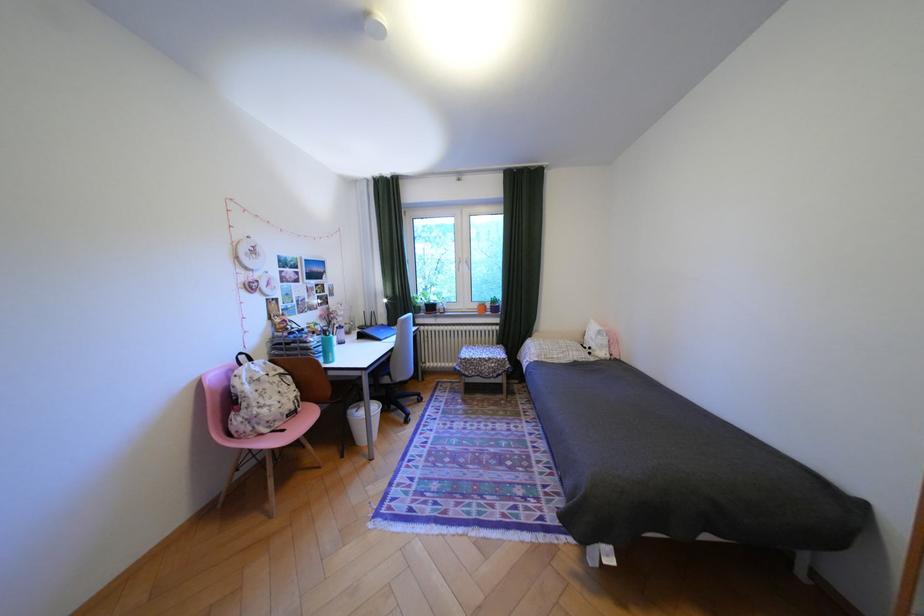
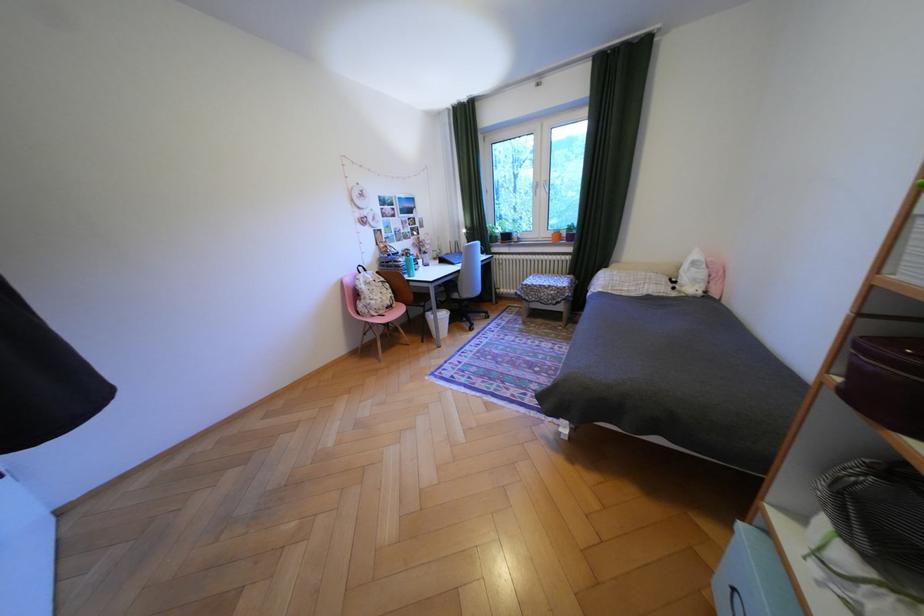
Find the pixel in the second image that matches the point at 289,424 in the first image.

(393, 312)